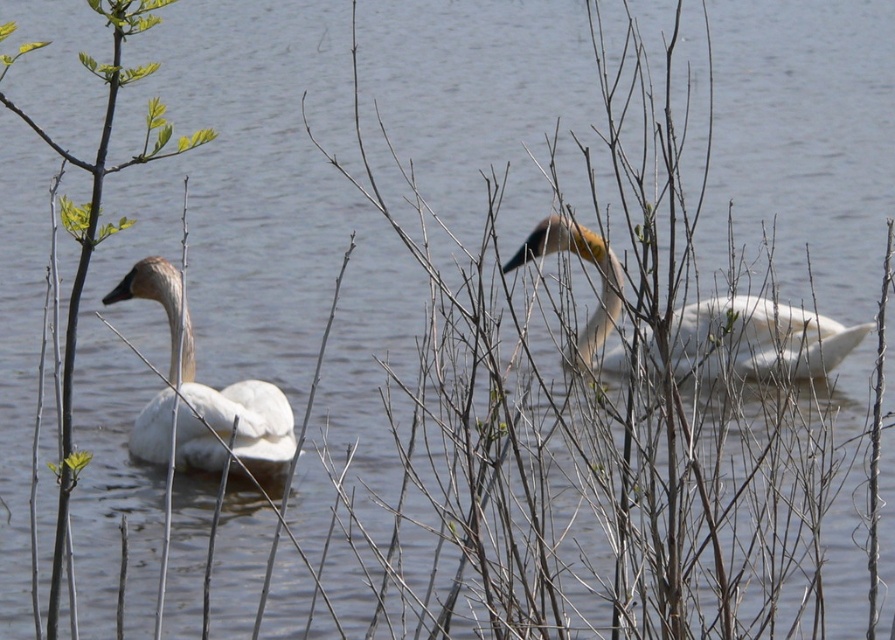
Describe the element at coordinates (757, 339) in the screenshot. I see `white matte swan at center` at that location.

Locate an element on the screen. Image resolution: width=895 pixels, height=640 pixels. white matte swan at center is located at coordinates (757, 339).

Does white matte swan at center have a greater height compared to green leafy branch at left?

In fact, white matte swan at center may be shorter than green leafy branch at left.

Does point (608, 260) come farther from viewer compared to point (82, 241)?

Yes, it is behind point (82, 241).

You are a GUI agent. You are given a task and a screenshot of the screen. Output one action in this format:
    pyautogui.click(x=<x>, y=<y>)
    Task: Click on the white matte swan at center
    
    Given the screenshot: What is the action you would take?
    pyautogui.click(x=757, y=339)

Who is higher up, white matte swan at left or green leafy branch at left?

green leafy branch at left is above.

Can you confirm if white matte swan at left is positioned to the right of green leafy branch at left?

In fact, white matte swan at left is to the left of green leafy branch at left.

What do you see at coordinates (212, 388) in the screenshot?
I see `white matte swan at left` at bounding box center [212, 388].

Image resolution: width=895 pixels, height=640 pixels. I want to click on white matte swan at left, so click(212, 388).